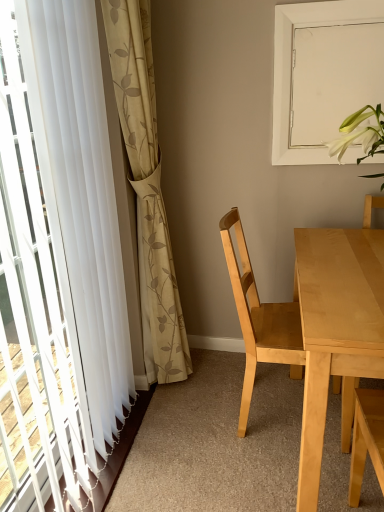
Question: Is light wood table at right behind white matte window screen at upper right?

Choices:
 (A) yes
 (B) no

Answer: (B)

Question: Is white matte window screen at upper right inside light wood table at right?

Choices:
 (A) no
 (B) yes

Answer: (A)

Question: Can you confirm if light wood table at right is wider than white matte window screen at upper right?

Choices:
 (A) no
 (B) yes

Answer: (B)

Question: Is light wood table at right in front of white matte window screen at upper right?

Choices:
 (A) no
 (B) yes

Answer: (B)

Question: Does light wood table at right have a smaller size compared to white matte window screen at upper right?

Choices:
 (A) no
 (B) yes

Answer: (A)

Question: Is point (243, 268) positioned closer to the camera than point (21, 293)?

Choices:
 (A) farther
 (B) closer

Answer: (A)

Question: From the image's perspective, is light wood chair at center located above or below white sheer curtain at left, the second curtain from the right?

Choices:
 (A) below
 (B) above

Answer: (A)

Question: Looking at the image, does light wood chair at center seem bigger or smaller compared to white sheer curtain at left, the 1th curtain in the left-to-right sequence?

Choices:
 (A) small
 (B) big

Answer: (A)

Question: Is light wood chair at center spatially inside white sheer curtain at left, the 1th curtain in the left-to-right sequence, or outside of it?

Choices:
 (A) inside
 (B) outside

Answer: (B)

Question: In terms of width, does white sheer curtain at left, the 1th curtain in the left-to-right sequence, look wider or thinner when compared to beige floral fabric curtain at left, positioned as the second curtain in left-to-right order?

Choices:
 (A) wide
 (B) thin

Answer: (B)

Question: Is point (9, 101) closer or farther from the camera than point (163, 245)?

Choices:
 (A) farther
 (B) closer

Answer: (B)

Question: Is white sheer curtain at left, the second curtain from the right, situated inside beige floral fabric curtain at left, positioned as the second curtain in left-to-right order, or outside?

Choices:
 (A) inside
 (B) outside

Answer: (B)

Question: In the image, is white sheer curtain at left, the 1th curtain in the left-to-right sequence, on the left side or the right side of beige floral fabric curtain at left, which appears as the first curtain when viewed from the right?

Choices:
 (A) right
 (B) left

Answer: (B)

Question: Is white matte window screen at upper right bigger or smaller than light wood chair at center?

Choices:
 (A) small
 (B) big

Answer: (A)

Question: Visually, is white matte window screen at upper right positioned to the left or to the right of light wood chair at center?

Choices:
 (A) left
 (B) right

Answer: (B)